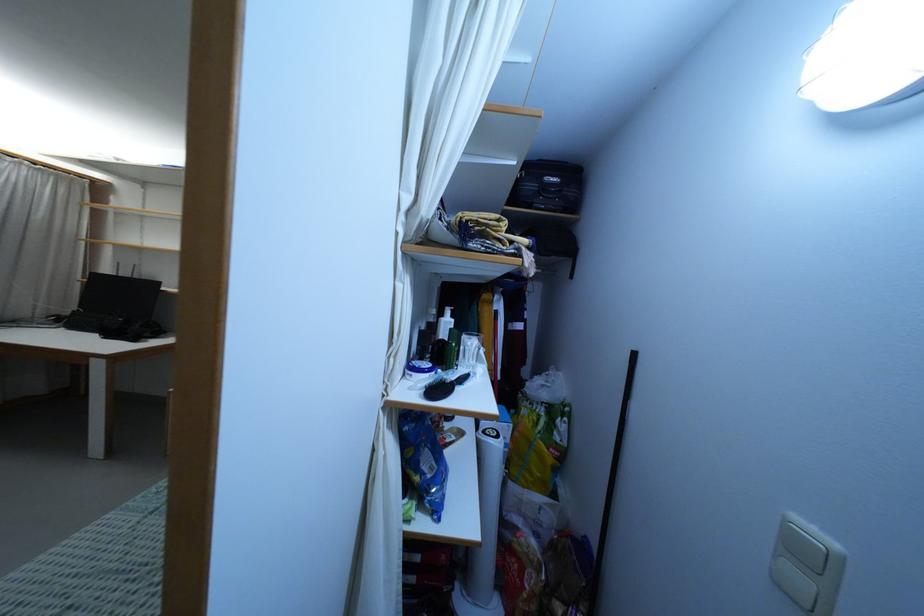
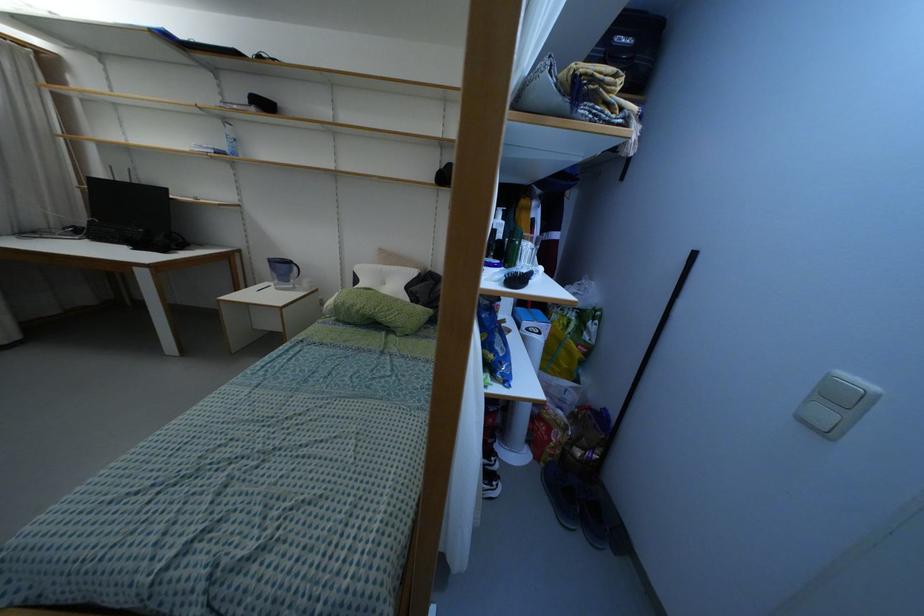
Question: The images are taken continuously from a first-person perspective. In which direction is your viewpoint rotating?

Choices:
 (A) Left
 (B) Right
 (C) Up
 (D) Down

Answer: (D)